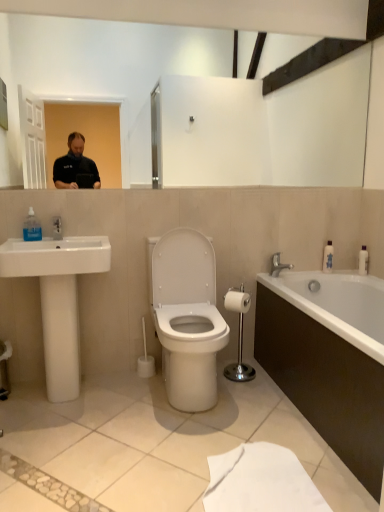
Question: Does white glossy bottle at right, the 1th toiletry in the left-to-right sequence, have a greater height compared to chrome metallic toilet paper holder at center?

Choices:
 (A) yes
 (B) no

Answer: (B)

Question: From the image's perspective, is white glossy bottle at right, the 1th toiletry in the left-to-right sequence, on chrome metallic toilet paper holder at center?

Choices:
 (A) yes
 (B) no

Answer: (A)

Question: Is white glossy bottle at right, arranged as the 2th toiletry when viewed from the right, smaller than chrome metallic toilet paper holder at center?

Choices:
 (A) yes
 (B) no

Answer: (A)

Question: From a real-world perspective, is white glossy bottle at right, the 1th toiletry in the left-to-right sequence, physically below chrome metallic toilet paper holder at center?

Choices:
 (A) yes
 (B) no

Answer: (B)

Question: Would you say chrome metallic toilet paper holder at center is part of white glossy bottle at right, arranged as the 2th toiletry when viewed from the right,'s contents?

Choices:
 (A) yes
 (B) no

Answer: (B)

Question: From the image's perspective, would you say white glossy bottle at right, the 1th toiletry in the left-to-right sequence, is shown under chrome metallic toilet paper holder at center?

Choices:
 (A) yes
 (B) no

Answer: (B)

Question: Is silver metallic faucet at right outside white plastic bottle at right, arranged as the 1th toiletry when viewed from the right?

Choices:
 (A) yes
 (B) no

Answer: (A)

Question: Can you confirm if silver metallic faucet at right is smaller than white plastic bottle at right, arranged as the 1th toiletry when viewed from the right?

Choices:
 (A) yes
 (B) no

Answer: (B)

Question: Can you confirm if silver metallic faucet at right is bigger than white plastic bottle at right, the 2th toiletry in the left-to-right sequence?

Choices:
 (A) no
 (B) yes

Answer: (B)

Question: From a real-world perspective, does silver metallic faucet at right sit lower than white plastic bottle at right, the 2th toiletry in the left-to-right sequence?

Choices:
 (A) yes
 (B) no

Answer: (A)

Question: Is white plastic bottle at right, arranged as the 1th toiletry when viewed from the right, inside silver metallic faucet at right?

Choices:
 (A) yes
 (B) no

Answer: (B)

Question: Is silver metallic faucet at right behind white plastic bottle at right, arranged as the 1th toiletry when viewed from the right?

Choices:
 (A) yes
 (B) no

Answer: (B)

Question: From the image's perspective, is silver metallic faucet at right located beneath white plastic toilet brush at center?

Choices:
 (A) no
 (B) yes

Answer: (A)